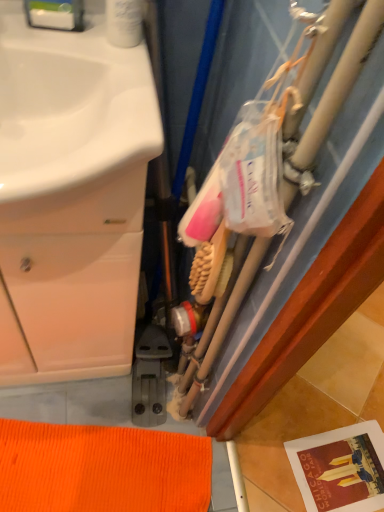
Question: From a real-world perspective, is wooden-bristled brush at center-right on top of white matte cabinet at left?

Choices:
 (A) no
 (B) yes

Answer: (B)

Question: Is wooden-bristled brush at center-right oriented towards white matte cabinet at left?

Choices:
 (A) yes
 (B) no

Answer: (B)

Question: Can you confirm if wooden-bristled brush at center-right is wider than white matte cabinet at left?

Choices:
 (A) no
 (B) yes

Answer: (A)

Question: Is wooden-bristled brush at center-right not near white matte cabinet at left?

Choices:
 (A) yes
 (B) no

Answer: (B)

Question: Does wooden-bristled brush at center-right have a larger size compared to white matte cabinet at left?

Choices:
 (A) yes
 (B) no

Answer: (B)

Question: Is wooden-bristled brush at center-right not within white matte cabinet at left?

Choices:
 (A) yes
 (B) no

Answer: (A)

Question: Can you confirm if white matte cabinet at left is shorter than wooden-bristled brush at center-right?

Choices:
 (A) no
 (B) yes

Answer: (A)

Question: Is white matte cabinet at left facing away from wooden-bristled brush at center-right?

Choices:
 (A) yes
 (B) no

Answer: (B)

Question: Could you tell me if white matte cabinet at left is facing wooden-bristled brush at center-right?

Choices:
 (A) yes
 (B) no

Answer: (B)

Question: Does white matte cabinet at left appear on the right side of wooden-bristled brush at center-right?

Choices:
 (A) no
 (B) yes

Answer: (A)

Question: Is white matte cabinet at left closer to camera compared to wooden-bristled brush at center-right?

Choices:
 (A) yes
 (B) no

Answer: (A)

Question: Is the depth of white matte cabinet at left greater than that of wooden-bristled brush at center-right?

Choices:
 (A) no
 (B) yes

Answer: (A)

Question: Considering the positions of wooden-bristled brush at center-right and white matte cabinet at left in the image, is wooden-bristled brush at center-right wider or thinner than white matte cabinet at left?

Choices:
 (A) thin
 (B) wide

Answer: (A)